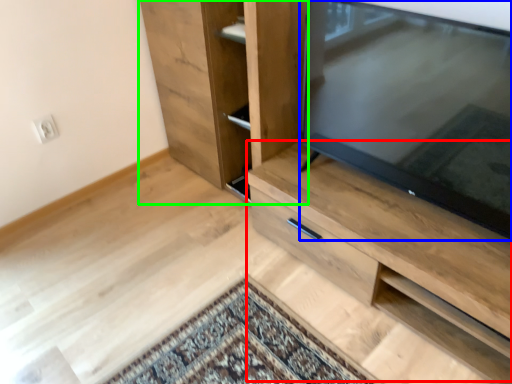
Question: Based on their relative distances, which object is nearer to cabinetry (highlighted by a red box)? Choose from television (highlighted by a blue box) and cupboard (highlighted by a green box).

Choices:
 (A) television
 (B) cupboard

Answer: (A)